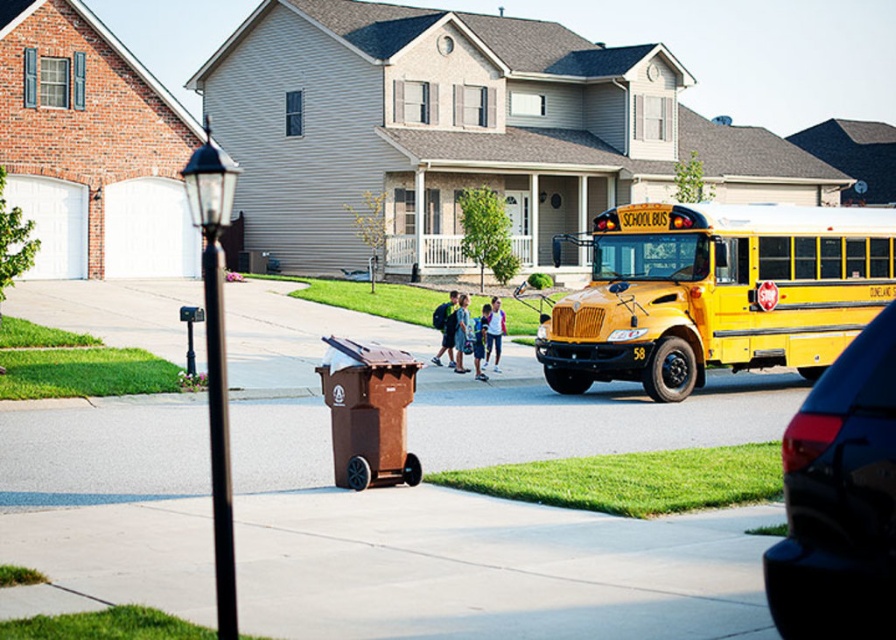
You are standing in the middle of the street and want to determine which of the two points, point (560, 333) or point (877, 452), is closer to you. Based on the scene description, which point is nearer?

Point (560, 333) is further to the viewer than point (877, 452). Wait, no, the description says the opposite. Let me check again. The Objects Description states that point (560, 333) is further to the viewer than point (877, 452). Therefore, the closer point would be point (877, 452). So the answer is point (877, 452) is closer.